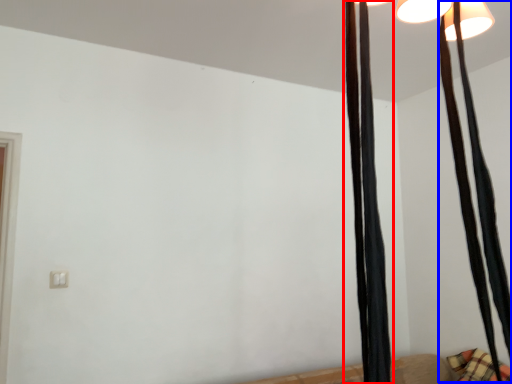
Question: Which of the following is the farthest to the observer, curtain (highlighted by a red box) or curtain (highlighted by a blue box)?

Choices:
 (A) curtain
 (B) curtain

Answer: (B)